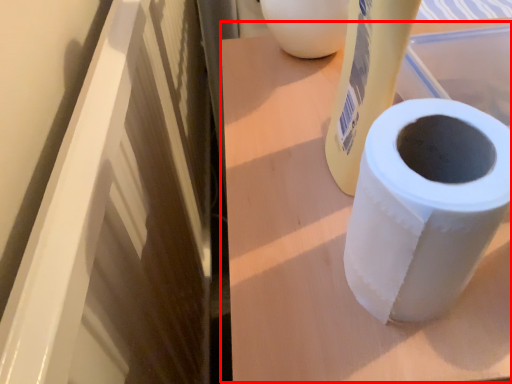
Question: From the image's perspective, considering the relative positions of table (annotated by the red box) and toilet paper in the image provided, where is table (annotated by the red box) located with respect to the staircase?

Choices:
 (A) below
 (B) above

Answer: (A)